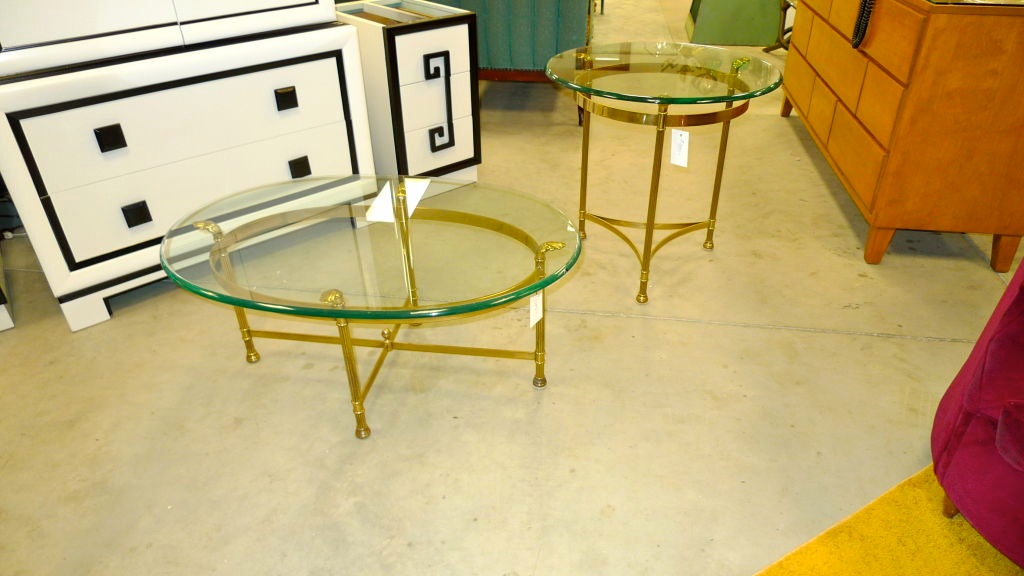
The image size is (1024, 576). What are the coordinates of `glass table tops` in the screenshot? It's located at (650, 77), (399, 267).